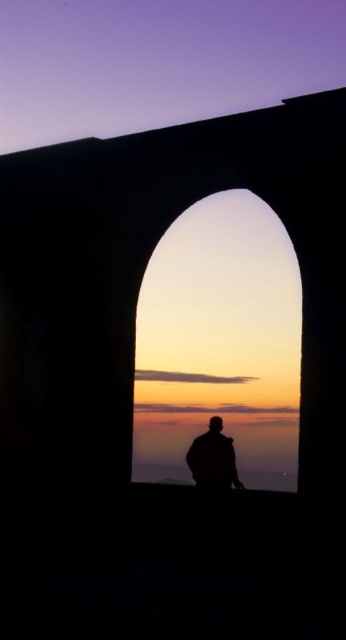
Which is above, matte stone archway at center or silhouette figure at center?

Positioned higher is matte stone archway at center.

Based on the photo, who is more distant from viewer, [141,380] or [211,444]?

The point [141,380] is behind.

Where is `matte stone archway at center`? matte stone archway at center is located at coordinates (220, 342).